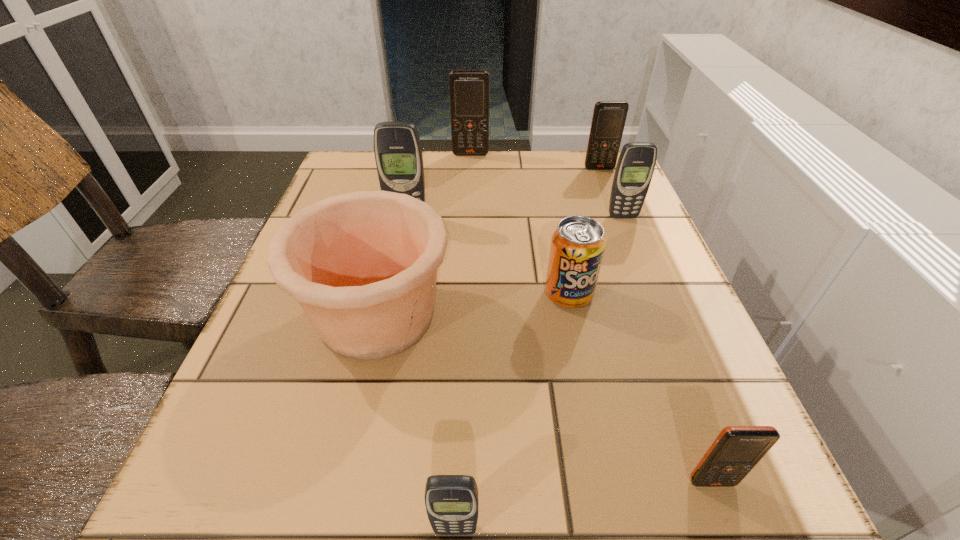
At what (x,y) coordinates should I click in order to perform the action: click on object situated at the far right corner. Please return your answer as a coordinate pair (x, y). Looking at the image, I should click on (609, 117).

Locate an element on the screen. object located at the near right corner is located at coordinates (734, 453).

In the image, there is a desktop. At what (x,y) coordinates should I click in order to perform the action: click on free space at the far edge. Please return your answer as a coordinate pair (x, y). Looking at the image, I should click on (457, 170).

Locate an element on the screen. The image size is (960, 540). vacant space at the near edge of the desktop is located at coordinates (494, 535).

At what (x,y) coordinates should I click in order to perform the action: click on vacant area at the left edge. Please return your answer as a coordinate pair (x, y). Looking at the image, I should click on (328, 376).

Image resolution: width=960 pixels, height=540 pixels. Identify the location of free space at the right edge of the desktop. click(x=649, y=354).

Identify the location of vacant space at the far left corner of the desktop. (344, 173).

Locate an element on the screen. Image resolution: width=960 pixels, height=540 pixels. free space between the leftmost cellular telephone and the smallest gray cellular telephone is located at coordinates (431, 373).

This screenshot has width=960, height=540. In order to click on free space between the pottery and the fifth object from left to right in this screenshot , I will do `click(472, 305)`.

Where is `empty location between the leftmost gray cellular telephone and the rightmost gray cellular telephone`? The height and width of the screenshot is (540, 960). empty location between the leftmost gray cellular telephone and the rightmost gray cellular telephone is located at coordinates (515, 217).